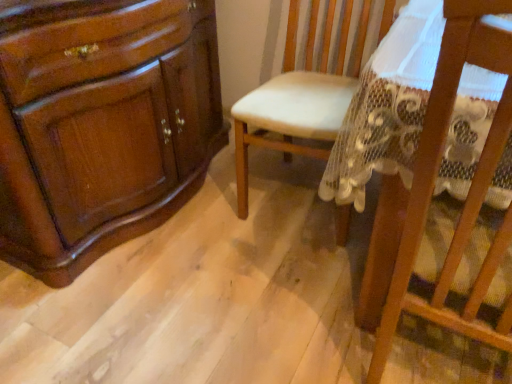
What do you see at coordinates (469, 189) in the screenshot?
I see `wooden chair at center, acting as the first chair starting from the front` at bounding box center [469, 189].

Identify the location of wooden chair at center, acting as the first chair starting from the front. (469, 189).

What is the approximate width of wooden chair at center, the 2th chair from the back?

wooden chair at center, the 2th chair from the back, is 21.76 inches wide.

What do you see at coordinates (298, 95) in the screenshot? I see `white leather chair at center, the 1th chair positioned from the back` at bounding box center [298, 95].

At what (x,y) coordinates should I click in order to perform the action: click on white leather chair at center, the 1th chair positioned from the back. Please return your answer as a coordinate pair (x, y). The image size is (512, 384). Looking at the image, I should click on (298, 95).

Measure the distance between point (x=291, y=38) and camera.

A distance of 6.13 feet exists between point (x=291, y=38) and camera.

Find the location of a particular element. Image resolution: width=512 pixels, height=384 pixels. wooden chair at center, the 2th chair from the back is located at coordinates (469, 189).

Based on their positions, is white leather chair at center, which is counted as the second chair, starting from the front, located to the left or right of wooden chair at center, acting as the first chair starting from the front?

From the image, it's evident that white leather chair at center, which is counted as the second chair, starting from the front, is to the left of wooden chair at center, acting as the first chair starting from the front.

Between white leather chair at center, which is counted as the second chair, starting from the front, and wooden chair at center, acting as the first chair starting from the front, which one is positioned in front?

wooden chair at center, acting as the first chair starting from the front.

Considering the positions of points (280, 143) and (507, 89), is point (280, 143) farther from camera compared to point (507, 89)?

That is True.

From the image's perspective, is white leather chair at center, the 1th chair positioned from the back, over wooden chair at center, acting as the first chair starting from the front?

Yes.

From a real-world perspective, which is physically below, white leather chair at center, which is counted as the second chair, starting from the front, or wooden chair at center, acting as the first chair starting from the front?

white leather chair at center, which is counted as the second chair, starting from the front, from a real-world perspective.

Is white leather chair at center, the 1th chair positioned from the back, wider than wooden chair at center, the 2th chair from the back?

Yes, white leather chair at center, the 1th chair positioned from the back, is wider than wooden chair at center, the 2th chair from the back.

Is white leather chair at center, the 1th chair positioned from the back, taller than wooden chair at center, the 2th chair from the back?

No, white leather chair at center, the 1th chair positioned from the back, is not taller than wooden chair at center, the 2th chair from the back.

Is white leather chair at center, the 1th chair positioned from the back, bigger than wooden chair at center, the 2th chair from the back?

Correct, white leather chair at center, the 1th chair positioned from the back, is larger in size than wooden chair at center, the 2th chair from the back.

Which is correct: white leather chair at center, the 1th chair positioned from the back, is inside wooden chair at center, the 2th chair from the back, or outside of it?

white leather chair at center, the 1th chair positioned from the back, is located beyond the bounds of wooden chair at center, the 2th chair from the back.

Is white leather chair at center, which is counted as the second chair, starting from the front, next to wooden chair at center, acting as the first chair starting from the front?

No, white leather chair at center, which is counted as the second chair, starting from the front, is not beside wooden chair at center, acting as the first chair starting from the front.

Is white leather chair at center, the 1th chair positioned from the back, positioned with its back to wooden chair at center, the 2th chair from the back?

No, wooden chair at center, the 2th chair from the back, is not at the back of white leather chair at center, the 1th chair positioned from the back.

What's the angular difference between white leather chair at center, the 1th chair positioned from the back, and wooden chair at center, acting as the first chair starting from the front,'s facing directions?

The angle between the facing direction of white leather chair at center, the 1th chair positioned from the back, and the facing direction of wooden chair at center, acting as the first chair starting from the front, is 172 degrees.

This screenshot has height=384, width=512. I want to click on chair below the white leather chair at center, which is counted as the second chair, starting from the front (from the image's perspective), so [469, 189].

Based on the photo, considering the relative positions of wooden chair at center, acting as the first chair starting from the front, and white leather chair at center, the 1th chair positioned from the back, in the image provided, is wooden chair at center, acting as the first chair starting from the front, to the left of white leather chair at center, the 1th chair positioned from the back, from the viewer's perspective?

No.

Who is more distant, wooden chair at center, the 2th chair from the back, or white leather chair at center, the 1th chair positioned from the back?

white leather chair at center, the 1th chair positioned from the back, is behind.

Considering the points (464, 315) and (257, 99), which point is in front, point (464, 315) or point (257, 99)?

Point (464, 315)

From the image's perspective, is wooden chair at center, the 2th chair from the back, located above white leather chair at center, which is counted as the second chair, starting from the front?

No, from the image's perspective, wooden chair at center, the 2th chair from the back, is not over white leather chair at center, which is counted as the second chair, starting from the front.

From a real-world perspective, is wooden chair at center, the 2th chair from the back, physically located above or below white leather chair at center, which is counted as the second chair, starting from the front?

wooden chair at center, the 2th chair from the back, is situated higher than white leather chair at center, which is counted as the second chair, starting from the front, in the real world.

Does wooden chair at center, the 2th chair from the back, have a greater width compared to white leather chair at center, the 1th chair positioned from the back?

No, wooden chair at center, the 2th chair from the back, is not wider than white leather chair at center, the 1th chair positioned from the back.

Who is shorter, wooden chair at center, the 2th chair from the back, or white leather chair at center, the 1th chair positioned from the back?

With less height is white leather chair at center, the 1th chair positioned from the back.

Consider the image. Who is smaller, wooden chair at center, acting as the first chair starting from the front, or white leather chair at center, the 1th chair positioned from the back?

wooden chair at center, acting as the first chair starting from the front, is smaller.

Is wooden chair at center, acting as the first chair starting from the front, completely or partially outside of white leather chair at center, the 1th chair positioned from the back?

Yes, wooden chair at center, acting as the first chair starting from the front, is not within white leather chair at center, the 1th chair positioned from the back.

Are wooden chair at center, acting as the first chair starting from the front, and white leather chair at center, the 1th chair positioned from the back, far apart?

No.

Is wooden chair at center, the 2th chair from the back, facing towards white leather chair at center, which is counted as the second chair, starting from the front?

No, wooden chair at center, the 2th chair from the back, does not turn towards white leather chair at center, which is counted as the second chair, starting from the front.

Image resolution: width=512 pixels, height=384 pixels. I want to click on chair above the wooden chair at center, acting as the first chair starting from the front (from the image's perspective), so click(298, 95).

Where is `chair that is under the wooden chair at center, acting as the first chair starting from the front (from a real-world perspective)`? Image resolution: width=512 pixels, height=384 pixels. chair that is under the wooden chair at center, acting as the first chair starting from the front (from a real-world perspective) is located at coordinates pos(298,95).

This screenshot has width=512, height=384. There is a white leather chair at center, the 1th chair positioned from the back. Find the location of `chair above it (from a real-world perspective)`. chair above it (from a real-world perspective) is located at coordinates (469, 189).